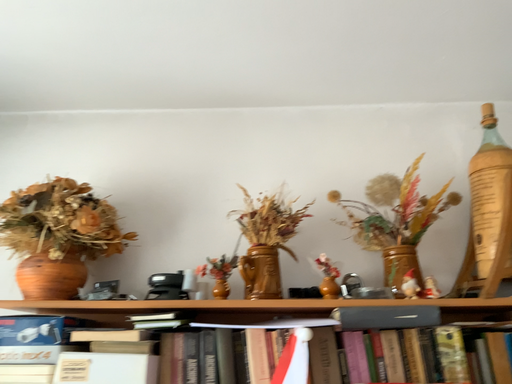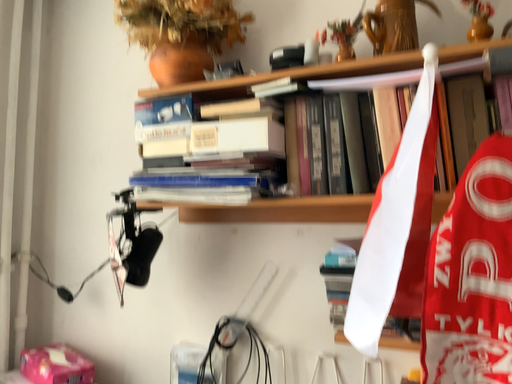
Question: Which way did the camera rotate in the video?

Choices:
 (A) rotated right
 (B) rotated left

Answer: (B)